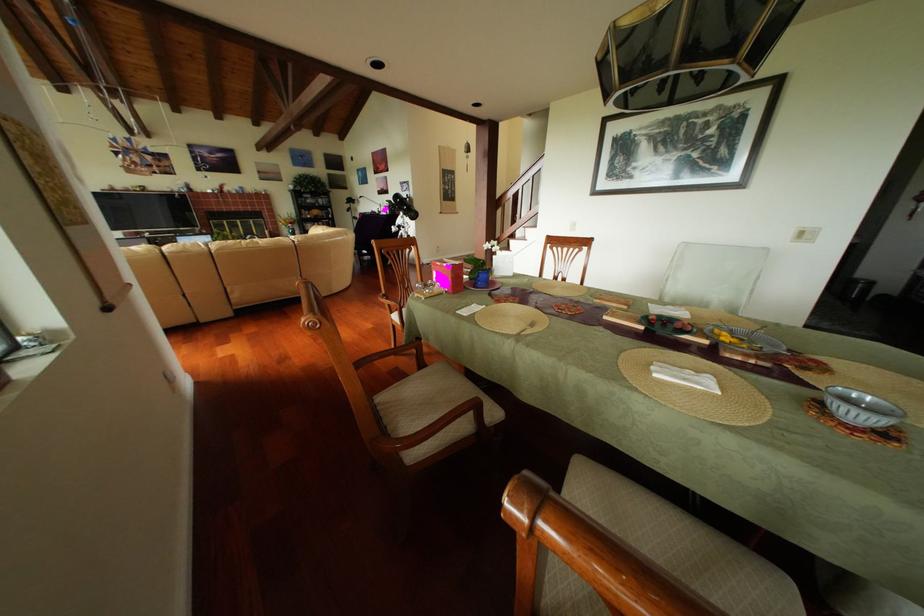
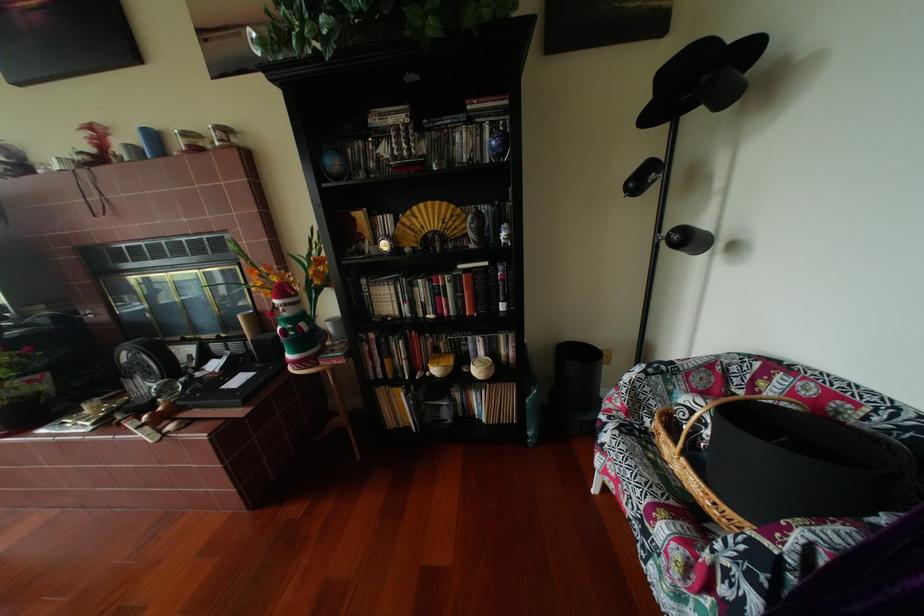
The point at (359, 205) is marked in the first image. Where is the corresponding point in the second image?

(659, 121)